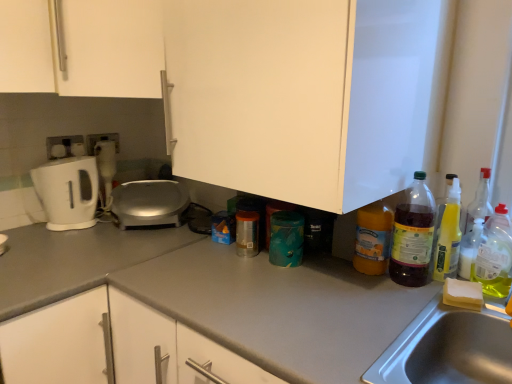
Identify the location of free space that is to the left of yellow paper towel at sink right. The image size is (512, 384). (395, 300).